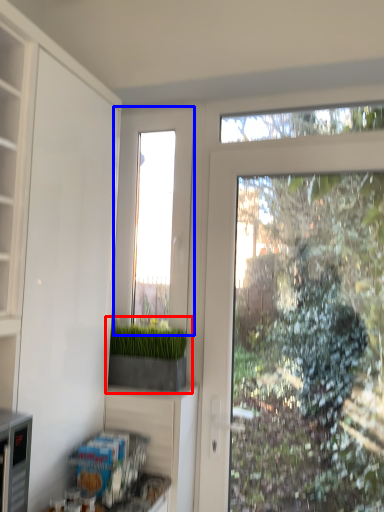
Question: Among these objects, which one is farthest to the camera, houseplant (highlighted by a red box) or window (highlighted by a blue box)?

Choices:
 (A) houseplant
 (B) window

Answer: (B)